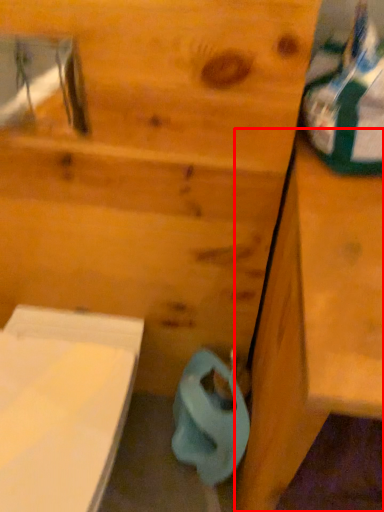
Question: Observing the image, what is the correct spatial positioning of vanity (annotated by the red box) in reference to toilet paper?

Choices:
 (A) right
 (B) left

Answer: (A)